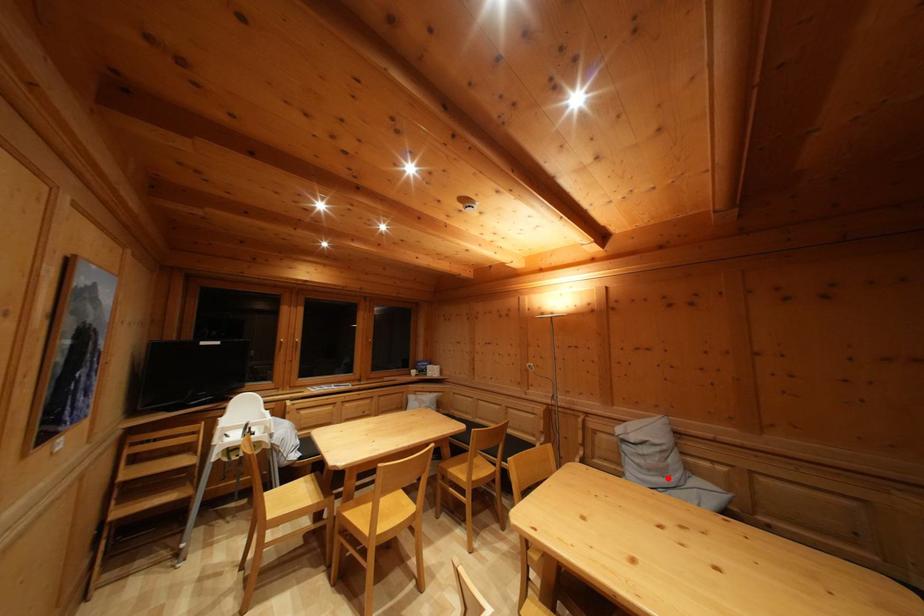
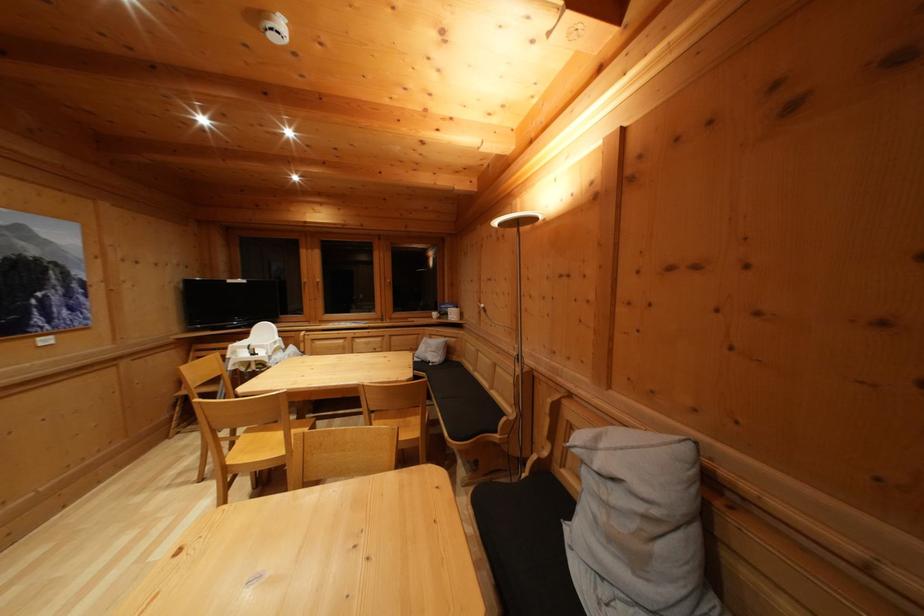
The point at the highlighted location is marked in the first image. Where is the corresponding point in the second image?

(640, 565)